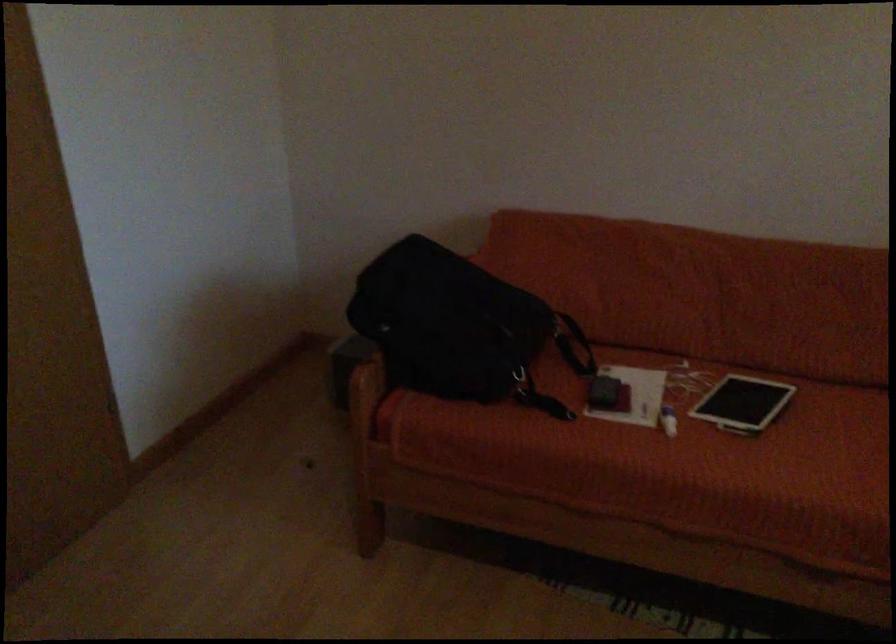
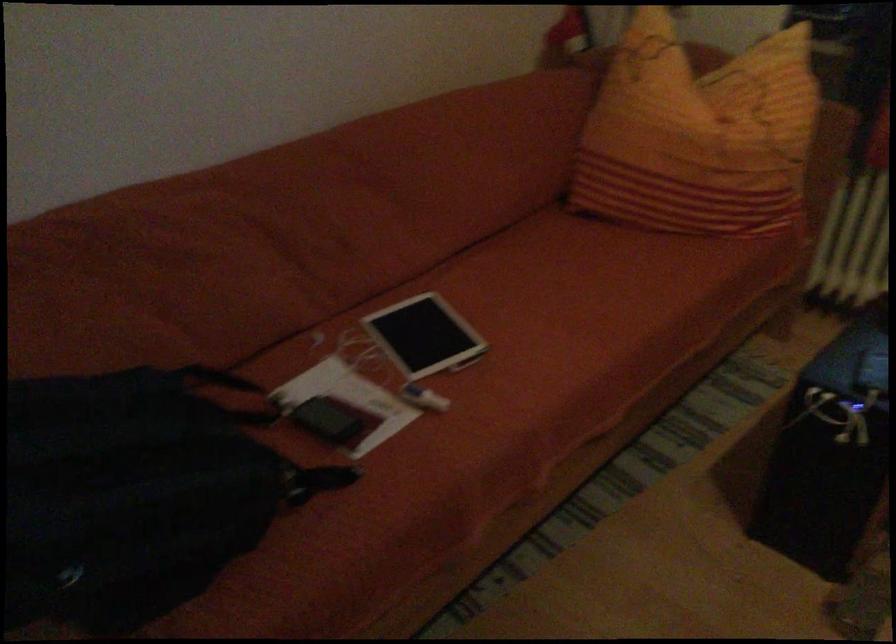
The point at (631,392) is marked in the first image. Where is the corresponding point in the second image?

(350, 401)